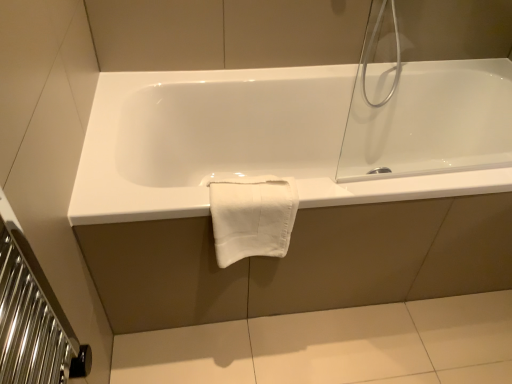
Question: Should I look upward or downward to see white cotton towel at center?

Choices:
 (A) down
 (B) up

Answer: (A)

Question: Does white cotton towel at center have a greater height compared to white glossy bathtub at center?

Choices:
 (A) no
 (B) yes

Answer: (A)

Question: Can we say white cotton towel at center lies outside white glossy bathtub at center?

Choices:
 (A) no
 (B) yes

Answer: (A)

Question: Is white cotton towel at center facing towards white glossy bathtub at center?

Choices:
 (A) yes
 (B) no

Answer: (A)

Question: Can white glossy bathtub at center be found inside white cotton towel at center?

Choices:
 (A) no
 (B) yes

Answer: (A)

Question: Is white cotton towel at center further to the viewer compared to white glossy bathtub at center?

Choices:
 (A) yes
 (B) no

Answer: (B)

Question: Is white cotton towel at center smaller than white glossy bathtub at center?

Choices:
 (A) yes
 (B) no

Answer: (A)

Question: Does white glossy bathtub at center have a smaller size compared to white cotton towel at center?

Choices:
 (A) no
 (B) yes

Answer: (A)

Question: Is white glossy bathtub at center oriented towards white cotton towel at center?

Choices:
 (A) yes
 (B) no

Answer: (A)

Question: Considering the relative positions of white glossy bathtub at center and white cotton towel at center in the image provided, is white glossy bathtub at center to the right of white cotton towel at center from the viewer's perspective?

Choices:
 (A) yes
 (B) no

Answer: (A)

Question: Is the depth of white glossy bathtub at center less than that of white cotton towel at center?

Choices:
 (A) no
 (B) yes

Answer: (A)

Question: Does white glossy bathtub at center have a lesser height compared to white cotton towel at center?

Choices:
 (A) yes
 (B) no

Answer: (B)

Question: Can you confirm if white glossy bathtub at center is positioned to the left of white cotton towel at center?

Choices:
 (A) no
 (B) yes

Answer: (A)

Question: Is point (282, 110) positioned closer to the camera than point (233, 205)?

Choices:
 (A) farther
 (B) closer

Answer: (A)